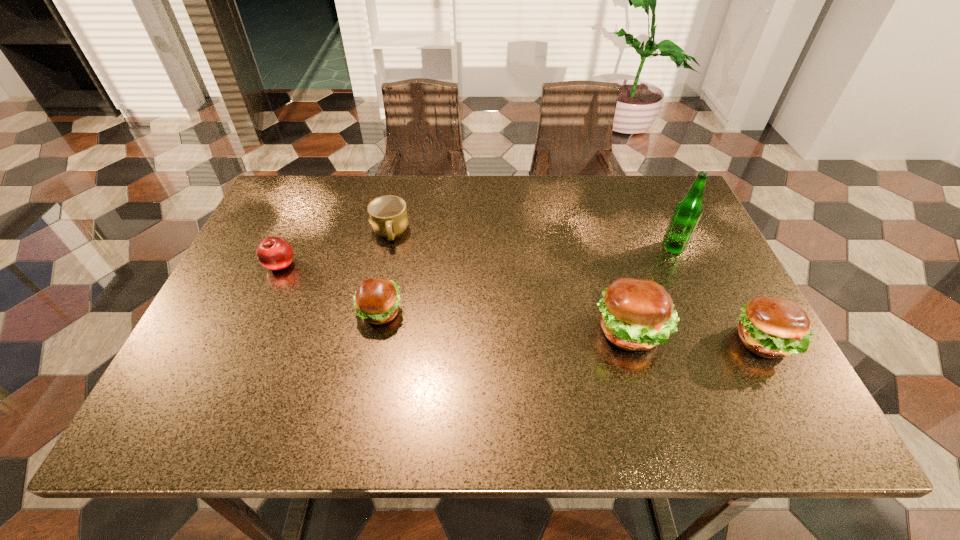
Where is `the leftmost hamburger`? Image resolution: width=960 pixels, height=540 pixels. the leftmost hamburger is located at coordinates click(x=376, y=301).

Identify the location of the third object from right to left. The image size is (960, 540). (637, 314).

Locate an element on the screen. Image resolution: width=960 pixels, height=540 pixels. the second hamburger from right to left is located at coordinates (637, 314).

This screenshot has width=960, height=540. Find the location of `the rightmost hamburger`. the rightmost hamburger is located at coordinates (770, 327).

I want to click on the second tallest hamburger, so click(x=770, y=327).

What are the coordinates of `the leftmost object` in the screenshot? It's located at (274, 253).

Find the location of `mug`. mug is located at coordinates (388, 217).

Where is `the fifth object from left to right`? the fifth object from left to right is located at coordinates (688, 211).

Locate an element on the screen. beer bottle is located at coordinates (688, 211).

You are a GUI agent. You are given a task and a screenshot of the screen. Output one action in this format:
    pyautogui.click(x=<x>, y=<y>)
    Task: Click on the blank area located on the left of the shortest hamburger
    The width and height of the screenshot is (960, 540).
    Given the screenshot: What is the action you would take?
    pyautogui.click(x=247, y=312)